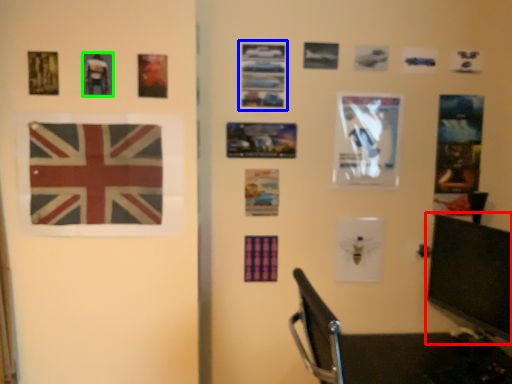
Question: Estimate the real-world distances between objects in this image. Which object is farther from computer monitor (highlighted by a red box), postcard (highlighted by a blue box) or picture frame (highlighted by a green box)?

Choices:
 (A) postcard
 (B) picture frame

Answer: (B)